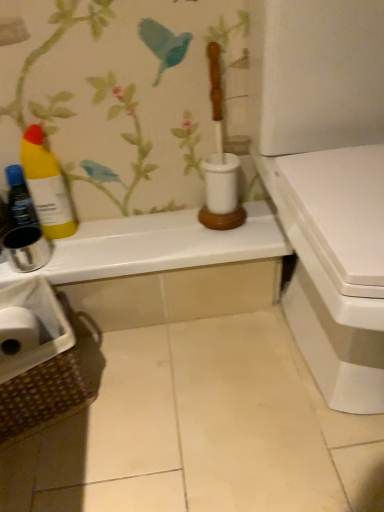
Question: From a real-world perspective, is brown woven laundry basket at lower left above or below white glossy toilet at right?

Choices:
 (A) above
 (B) below

Answer: (B)

Question: Choose the correct answer: Is brown woven laundry basket at lower left inside white glossy toilet at right or outside it?

Choices:
 (A) inside
 (B) outside

Answer: (B)

Question: Which object is positioned closest to the white glossy counter top at upper center?

Choices:
 (A) yellow matte bottle at left, the 1th bottle viewed from the right
 (B) metallic silver bottle at left, which is counted as the 2th bottle, starting from the right
 (C) brown woven laundry basket at lower left
 (D) white glossy toilet at right

Answer: (A)

Question: Which of these objects is positioned farthest from the brown woven laundry basket at lower left?

Choices:
 (A) white glossy counter top at upper center
 (B) metallic silver bottle at left, which is counted as the 2th bottle, starting from the right
 (C) white glossy toilet at right
 (D) yellow matte bottle at left, the 1th bottle viewed from the right

Answer: (C)